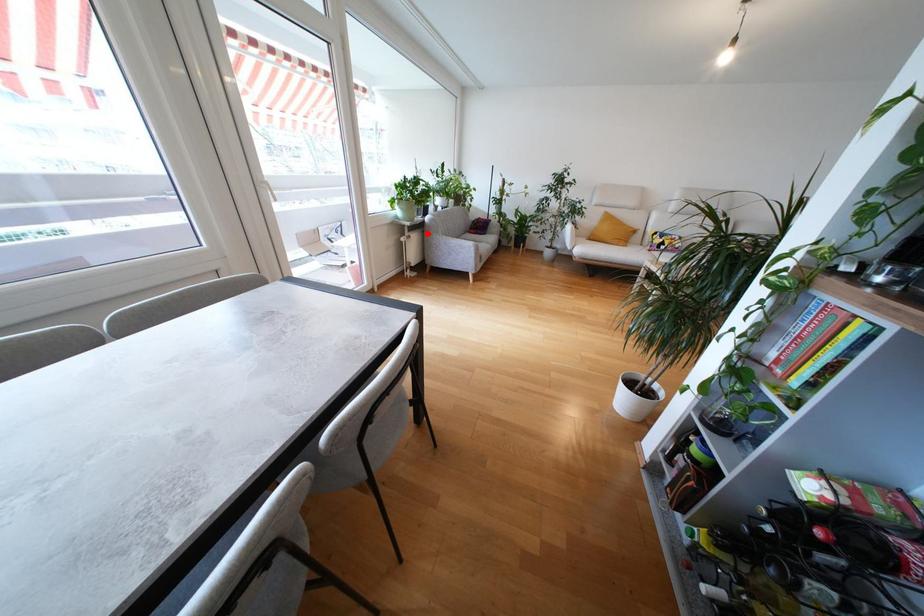
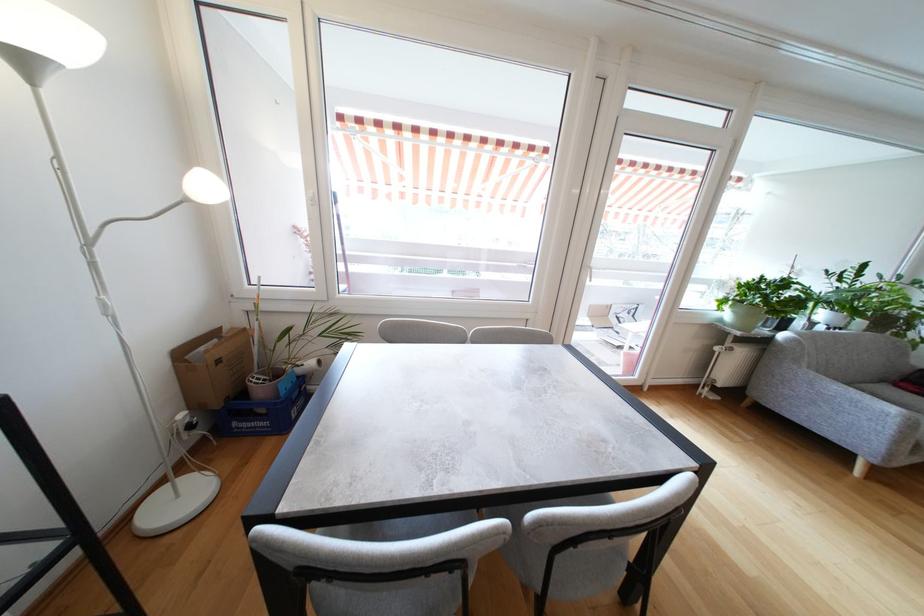
In the second image, find the point that corresponds to the highlighted location in the first image.

(768, 352)